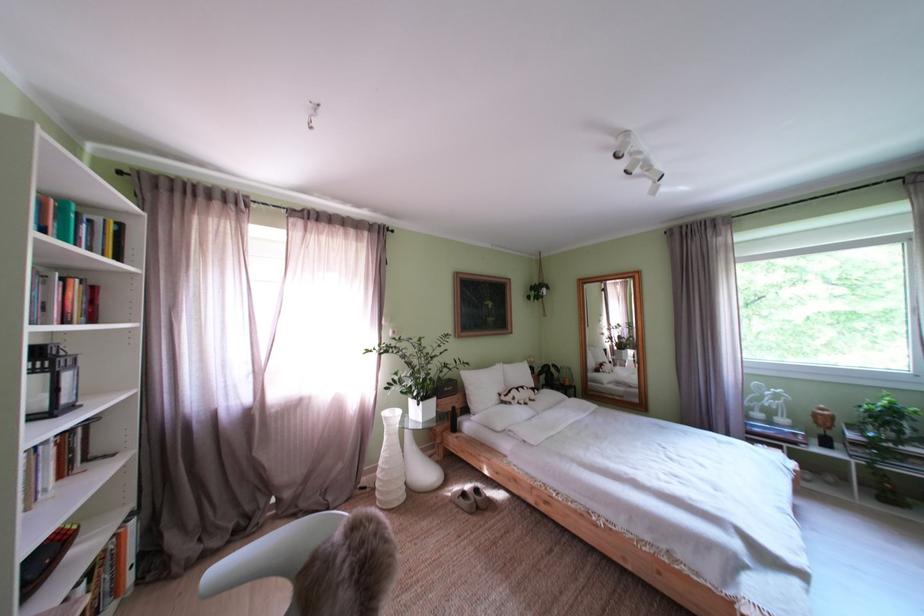
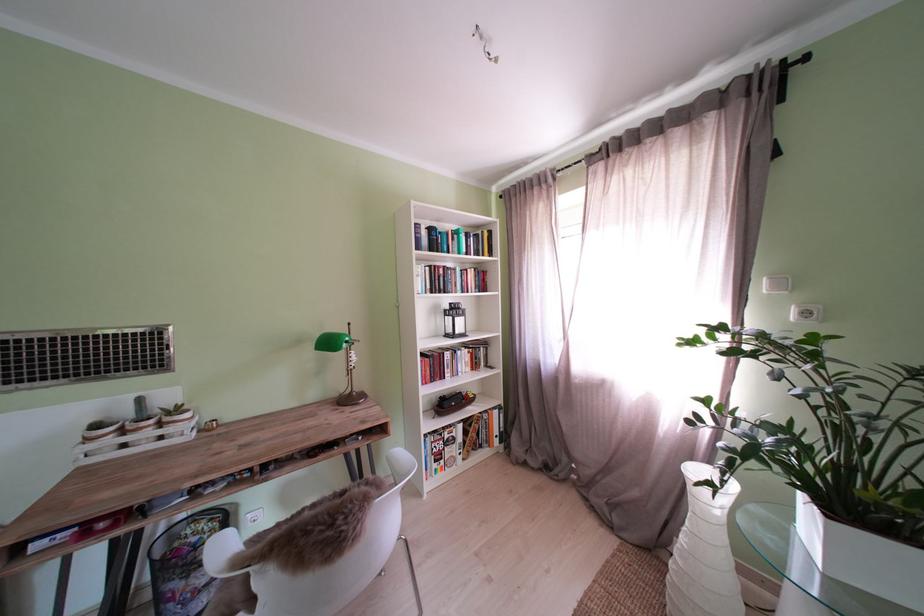
Locate, in the second image, the point that corresponds to the point at 406,338 in the first image.

(818, 318)